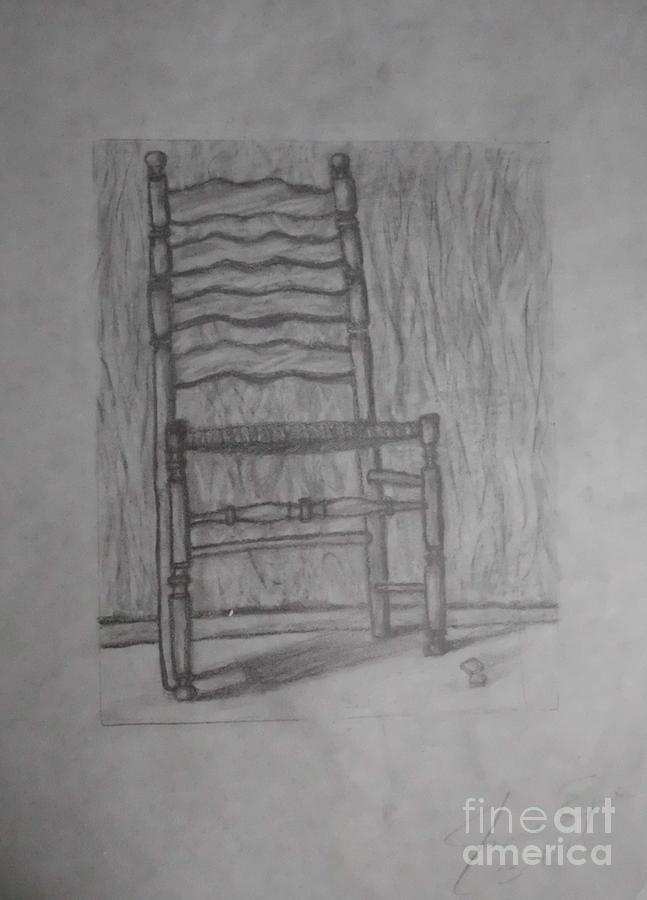
The image size is (647, 900). In order to click on wooden chair leg with design cuts in this screenshot , I will do `click(437, 517)`.